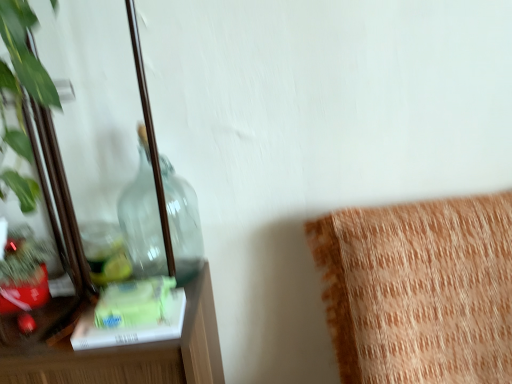
Question: From a real-world perspective, does transparent glass bottle at left sit lower than orange textured cushion at upper right?

Choices:
 (A) yes
 (B) no

Answer: (B)

Question: Are transparent glass bottle at left and orange textured cushion at upper right located far from each other?

Choices:
 (A) yes
 (B) no

Answer: (B)

Question: Does transparent glass bottle at left have a larger size compared to orange textured cushion at upper right?

Choices:
 (A) yes
 (B) no

Answer: (B)

Question: Can you confirm if transparent glass bottle at left is smaller than orange textured cushion at upper right?

Choices:
 (A) yes
 (B) no

Answer: (A)

Question: Is transparent glass bottle at left positioned beyond the bounds of orange textured cushion at upper right?

Choices:
 (A) no
 (B) yes

Answer: (B)

Question: Is transparent glass bottle at left further to the viewer compared to orange textured cushion at upper right?

Choices:
 (A) no
 (B) yes

Answer: (B)

Question: Is clear glass mirror at left positioned in front of transparent glass bottle at left?

Choices:
 (A) yes
 (B) no

Answer: (A)

Question: Can you confirm if clear glass mirror at left is shorter than transparent glass bottle at left?

Choices:
 (A) no
 (B) yes

Answer: (A)

Question: From the image's perspective, is clear glass mirror at left beneath transparent glass bottle at left?

Choices:
 (A) yes
 (B) no

Answer: (B)

Question: Does clear glass mirror at left have a smaller size compared to transparent glass bottle at left?

Choices:
 (A) no
 (B) yes

Answer: (A)

Question: Is clear glass mirror at left not inside transparent glass bottle at left?

Choices:
 (A) no
 (B) yes

Answer: (B)

Question: Could you tell me if clear glass mirror at left is turned towards transparent glass bottle at left?

Choices:
 (A) yes
 (B) no

Answer: (B)

Question: Does transparent glass bottle at left have a greater width compared to clear glass mirror at left?

Choices:
 (A) yes
 (B) no

Answer: (B)